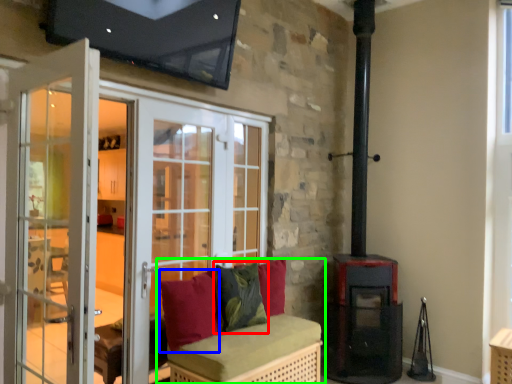
Question: Which is farther away from pillow (highlighted by a red box)? pillow (highlighted by a blue box) or furniture (highlighted by a green box)?

Choices:
 (A) pillow
 (B) furniture

Answer: (A)